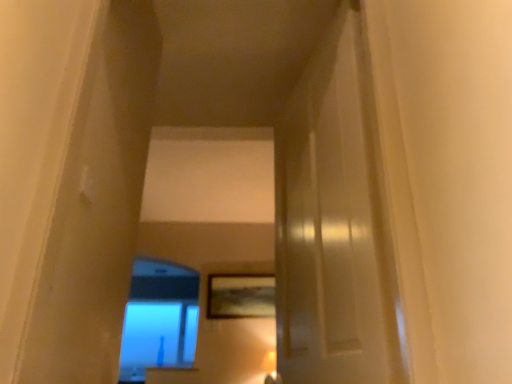
Question: Looking at the image, does wooden textured picture frame at center seem bigger or smaller compared to blue glass window at lower left?

Choices:
 (A) small
 (B) big

Answer: (A)

Question: Is wooden textured picture frame at center inside or outside of blue glass window at lower left?

Choices:
 (A) outside
 (B) inside

Answer: (A)

Question: Visually, is wooden textured picture frame at center positioned to the left or to the right of blue glass window at lower left?

Choices:
 (A) right
 (B) left

Answer: (A)

Question: In terms of height, does blue glass window at lower left look taller or shorter compared to wooden textured picture frame at center?

Choices:
 (A) short
 (B) tall

Answer: (B)

Question: Is blue glass window at lower left inside the boundaries of wooden textured picture frame at center, or outside?

Choices:
 (A) outside
 (B) inside

Answer: (A)

Question: Considering the positions of blue glass window at lower left and wooden textured picture frame at center in the image, is blue glass window at lower left wider or thinner than wooden textured picture frame at center?

Choices:
 (A) thin
 (B) wide

Answer: (B)

Question: Considering the positions of blue glass window at lower left and wooden textured picture frame at center in the image, is blue glass window at lower left bigger or smaller than wooden textured picture frame at center?

Choices:
 (A) big
 (B) small

Answer: (A)